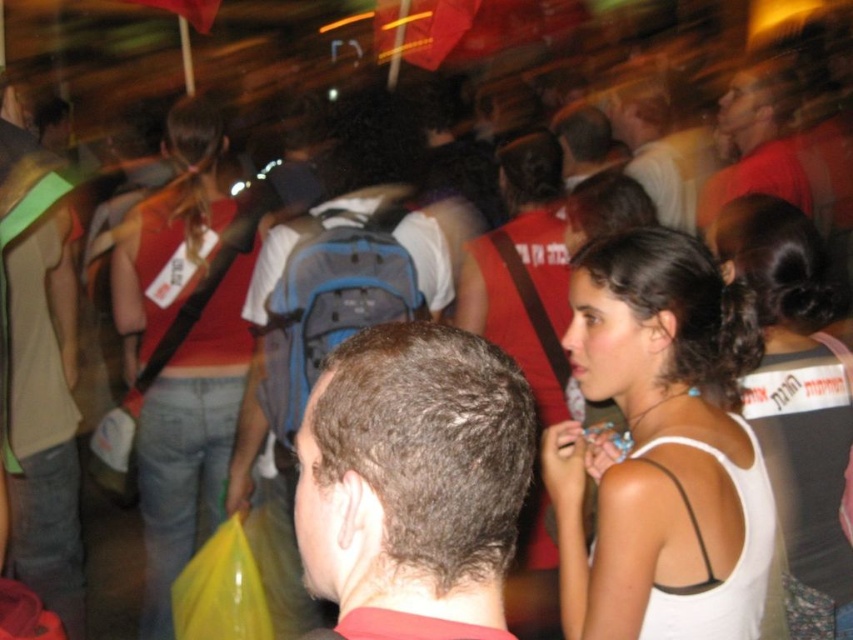
From the picture: Is dark brown hair at center positioned at the back of blue fabric backpack at center?

No.

Which of these two, dark brown hair at center or blue fabric backpack at center, stands taller?

blue fabric backpack at center is taller.

Who is more forward, (335, 538) or (433, 276)?

Point (335, 538)

You are a GUI agent. You are given a task and a screenshot of the screen. Output one action in this format:
    pyautogui.click(x=<x>, y=<y>)
    Task: Click on the dark brown hair at center
    
    Given the screenshot: What is the action you would take?
    pyautogui.click(x=413, y=481)

Consider the image. Between white matte tank top at center and blue fabric backpack at center, which one is positioned lower?

white matte tank top at center

Find the location of `white matte tank top at center`. white matte tank top at center is located at coordinates (660, 448).

Is point (614, 566) positioned behind point (236, 464)?

That is False.

Find the location of a particular element. white matte tank top at center is located at coordinates (660, 448).

Can you confirm if matte red tank top at left is positioned below matte red shirt at upper right?

Yes.

From the picture: Is matte red tank top at left closer to the viewer compared to matte red shirt at upper right?

Yes.

The width and height of the screenshot is (853, 640). In order to click on matte red tank top at left in this screenshot , I will do `click(190, 435)`.